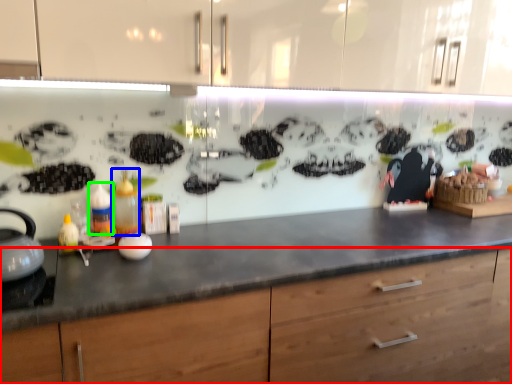
Question: Estimate the real-world distances between objects in this image. Which object is closer to cabinetry (highlighted by a red box), bottle (highlighted by a blue box) or bottle (highlighted by a green box)?

Choices:
 (A) bottle
 (B) bottle

Answer: (A)